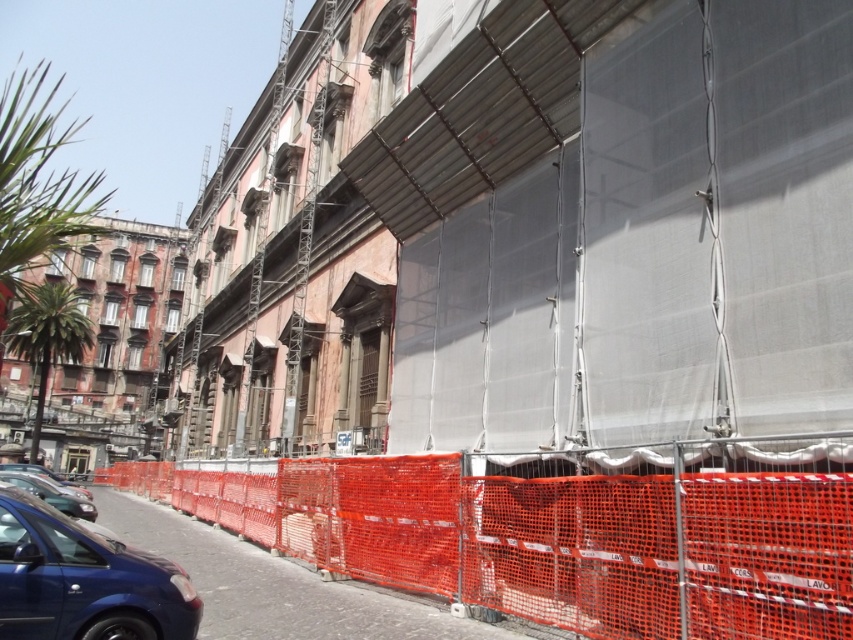
Question: Which is farther from the blue metallic car at lower left?

Choices:
 (A) orange mesh fence at lower left
 (B) matte black car at lower left
 (C) metallic blue car at lower left

Answer: (C)

Question: Which object appears closest to the camera in this image?

Choices:
 (A) matte black car at lower left
 (B) orange mesh fence at lower left

Answer: (B)

Question: Where is orange mesh fence at lower left located in relation to blue metallic car at lower left in the image?

Choices:
 (A) above
 (B) below

Answer: (A)

Question: Estimate the real-world distances between objects in this image. Which object is closer to the orange mesh fence at lower left?

Choices:
 (A) blue metallic car at lower left
 (B) matte black car at lower left
 (C) metallic blue car at lower left

Answer: (C)

Question: Does metallic blue car at lower left have a greater width compared to blue metallic car at lower left?

Choices:
 (A) no
 (B) yes

Answer: (A)

Question: Is matte black car at lower left to the right of blue metallic car at lower left from the viewer's perspective?

Choices:
 (A) yes
 (B) no

Answer: (A)